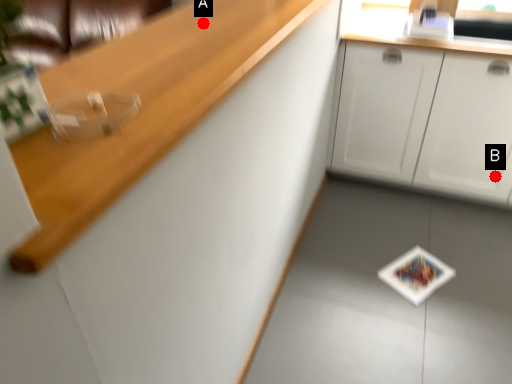
Question: Two points are circled on the image, labeled by A and B beside each circle. Which point appears closest to the camera in this image?

Choices:
 (A) A is closer
 (B) B is closer

Answer: (A)